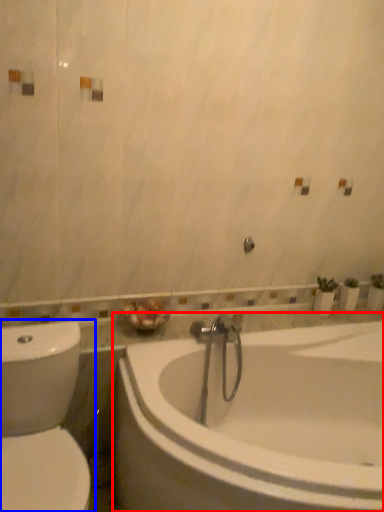
Question: Which of the following is the closest to the observer, bathtub (highlighted by a red box) or toilet (highlighted by a blue box)?

Choices:
 (A) bathtub
 (B) toilet

Answer: (A)